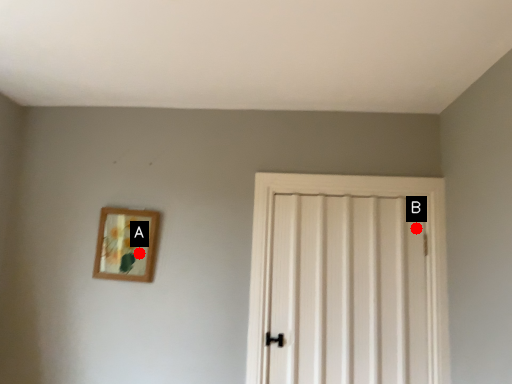
Question: Two points are circled on the image, labeled by A and B beside each circle. Which point is farther from the camera taking this photo?

Choices:
 (A) A is further
 (B) B is further

Answer: (A)